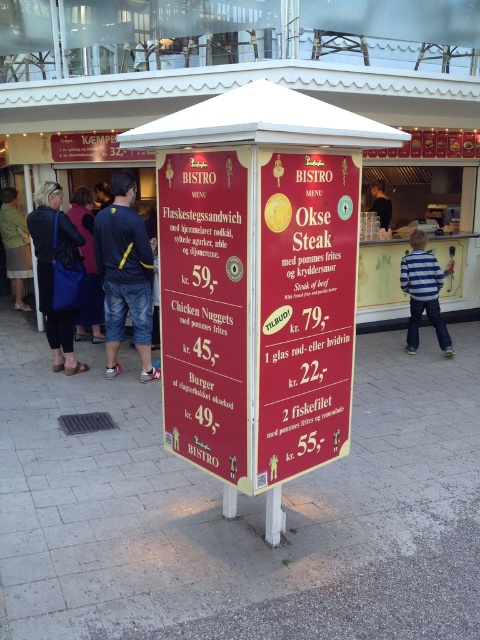
Question: Is velvet purple jacket at center to the right of black fabric apron at center from the viewer's perspective?

Choices:
 (A) yes
 (B) no

Answer: (B)

Question: Is red glossy menu board at center bigger than striped cotton shirt at right?

Choices:
 (A) no
 (B) yes

Answer: (B)

Question: Which object appears farthest from the camera in this image?

Choices:
 (A) striped cotton shirt at right
 (B) light beige skirt at lower left
 (C) denim shorts at left
 (D) velvet purple jacket at center

Answer: (B)

Question: In this image, where is matte red menu board at center located relative to light beige skirt at lower left?

Choices:
 (A) below
 (B) above

Answer: (A)

Question: Which point is farther to the camera?

Choices:
 (A) (235, 444)
 (B) (235, 438)
 (C) (120, 180)

Answer: (C)

Question: Which point is closer to the camera taking this photo?

Choices:
 (A) (296, 192)
 (B) (272, 358)
 (C) (85, 316)

Answer: (A)